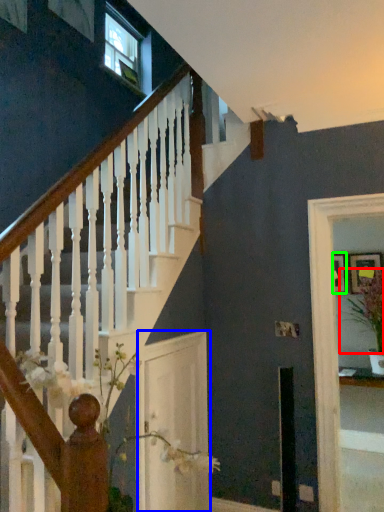
Question: Considering the real-world distances, which object is farthest from plant (highlighted by a red box)? glass door (highlighted by a blue box) or picture frame (highlighted by a green box)?

Choices:
 (A) glass door
 (B) picture frame

Answer: (A)